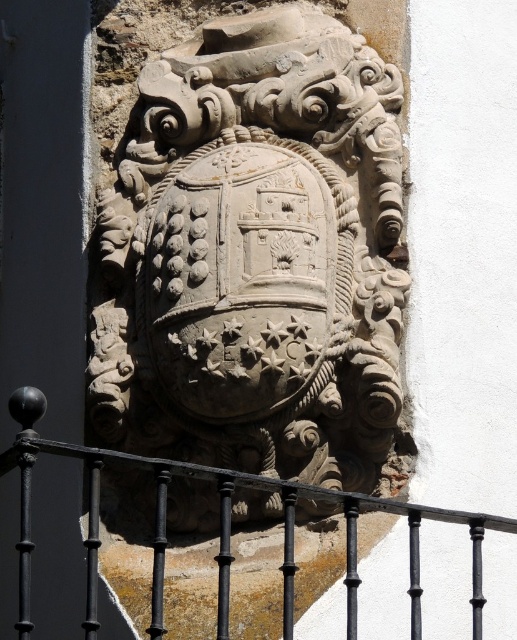
Question: Can you confirm if carved stone shield at center is thinner than black wrought iron at center?

Choices:
 (A) yes
 (B) no

Answer: (A)

Question: Among these objects, which one is farthest from the camera?

Choices:
 (A) carved stone shield at center
 (B) black wrought iron at center

Answer: (A)

Question: Is the position of carved stone shield at center more distant than that of black wrought iron at center?

Choices:
 (A) yes
 (B) no

Answer: (A)

Question: Is carved stone shield at center to the right of black wrought iron at center from the viewer's perspective?

Choices:
 (A) no
 (B) yes

Answer: (B)